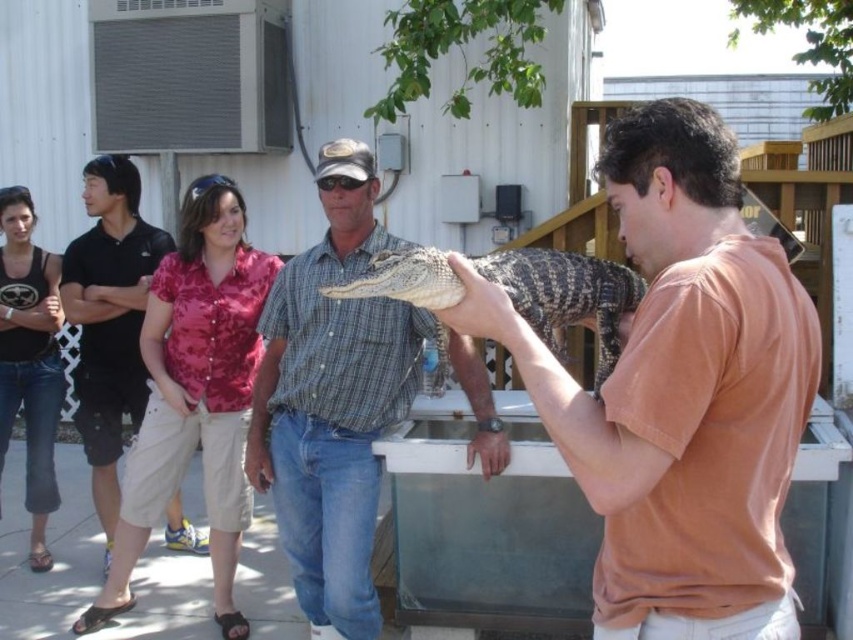
Is point (474, 320) more distant than point (122, 248)?

No, it is in front of (122, 248).

Can you confirm if matte orange t-shirt at center is smaller than black cotton shirt at left?

Incorrect, matte orange t-shirt at center is not smaller in size than black cotton shirt at left.

Does point (682, 182) come farther from viewer compared to point (65, 305)?

No.

Find the location of a particular element. matte orange t-shirt at center is located at coordinates (680, 392).

Looking at this image, can you confirm if black cotton shirt at left is thinner than shiny brown alligator at center?

Yes, black cotton shirt at left is thinner than shiny brown alligator at center.

Does black cotton shirt at left have a larger size compared to shiny brown alligator at center?

Yes.

Which is behind, point (109, 186) or point (473, 264)?

Positioned behind is point (109, 186).

Where is `black cotton shirt at left`? This screenshot has height=640, width=853. black cotton shirt at left is located at coordinates (109, 320).

Which is more to the left, checkered shirt at center or shiny brown alligator at center?

From the viewer's perspective, checkered shirt at center appears more on the left side.

Does checkered shirt at center have a lesser height compared to shiny brown alligator at center?

Incorrect, checkered shirt at center's height does not fall short of shiny brown alligator at center's.

Does point (395, 304) lie behind point (608, 264)?

Yes, point (395, 304) is farther from viewer.

Where is `checkered shirt at center`? This screenshot has width=853, height=640. checkered shirt at center is located at coordinates (332, 401).